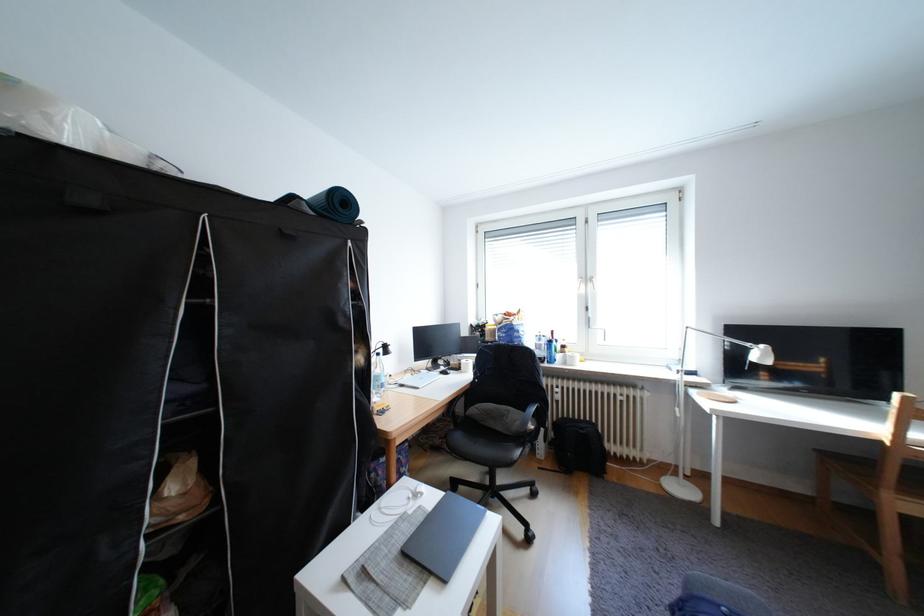
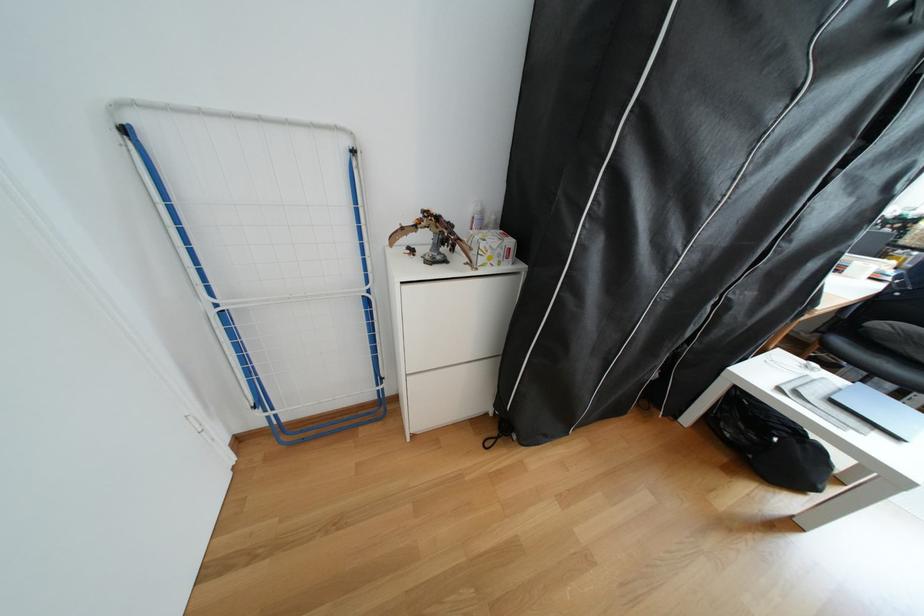
Locate, in the second image, the point that corresponds to the point at 456,582 in the first image.

(908, 439)